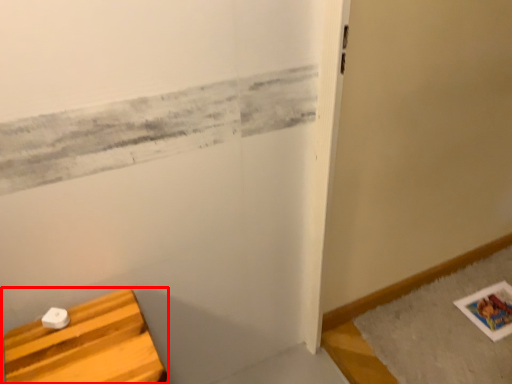
Question: From the image's perspective, what is the correct spatial relationship of furniture (annotated by the red box) in relation to bath mat?

Choices:
 (A) below
 (B) above

Answer: (A)